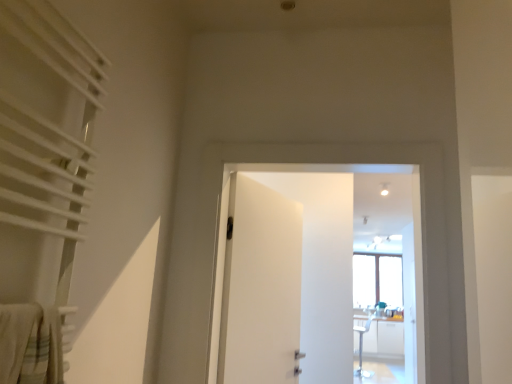
Question: Is white matte door at center, the 2th door from the left, at the back of white matte door at center, positioned as the second door in right-to-left order?

Choices:
 (A) no
 (B) yes

Answer: (B)

Question: Is white matte door at center, positioned as the second door in right-to-left order, with white matte door at center, placed as the 1th door when sorted from right to left?

Choices:
 (A) yes
 (B) no

Answer: (B)

Question: From a real-world perspective, is white matte door at center, which ranks as the 1th door in left-to-right order, positioned over white matte door at center, placed as the 1th door when sorted from right to left, based on gravity?

Choices:
 (A) no
 (B) yes

Answer: (A)

Question: Is white matte door at center, which ranks as the 1th door in left-to-right order, bigger than white matte door at center, the 2th door from the left?

Choices:
 (A) yes
 (B) no

Answer: (B)

Question: From a real-world perspective, is white matte door at center, positioned as the second door in right-to-left order, positioned under white matte door at center, the 2th door from the left, based on gravity?

Choices:
 (A) yes
 (B) no

Answer: (A)

Question: Relative to white textured curtain at left, is white matte door at center, placed as the 1th door when sorted from right to left, in front or behind?

Choices:
 (A) front
 (B) behind

Answer: (B)

Question: In terms of width, does white matte door at center, the 2th door from the left, look wider or thinner when compared to white textured curtain at left?

Choices:
 (A) thin
 (B) wide

Answer: (B)

Question: Is white matte door at center, the 2th door from the left, situated inside white textured curtain at left or outside?

Choices:
 (A) inside
 (B) outside

Answer: (B)

Question: Would you say white matte door at center, the 2th door from the left, is to the left or to the right of white textured curtain at left in the picture?

Choices:
 (A) right
 (B) left

Answer: (A)

Question: In the image, is white matte door at center, the 2th door from the left, positioned in front of or behind white matte door at center, which ranks as the 1th door in left-to-right order?

Choices:
 (A) front
 (B) behind

Answer: (A)

Question: Would you say white matte door at center, the 2th door from the left, is to the left or to the right of white matte door at center, which ranks as the 1th door in left-to-right order, in the picture?

Choices:
 (A) right
 (B) left

Answer: (A)

Question: From a real-world perspective, relative to white matte door at center, which ranks as the 1th door in left-to-right order, is white matte door at center, placed as the 1th door when sorted from right to left, vertically above or below?

Choices:
 (A) below
 (B) above

Answer: (B)

Question: Would you say white matte door at center, placed as the 1th door when sorted from right to left, is inside or outside white matte door at center, which ranks as the 1th door in left-to-right order?

Choices:
 (A) outside
 (B) inside

Answer: (A)

Question: Is white matte door at center, positioned as the second door in right-to-left order, in front of or behind white textured curtain at left in the image?

Choices:
 (A) behind
 (B) front

Answer: (A)

Question: Is point (269, 220) positioned closer to the camera than point (14, 144)?

Choices:
 (A) closer
 (B) farther

Answer: (B)